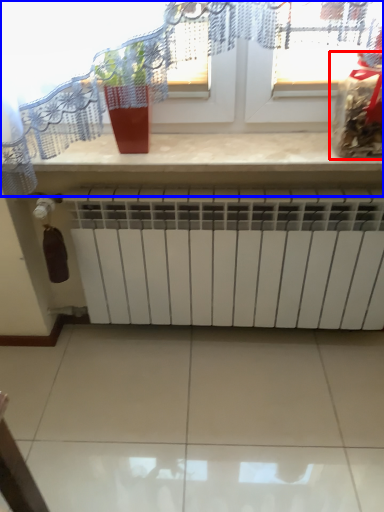
Question: Which of the following is the farthest to the observer, food (highlighted by a red box) or window (highlighted by a blue box)?

Choices:
 (A) food
 (B) window

Answer: (B)